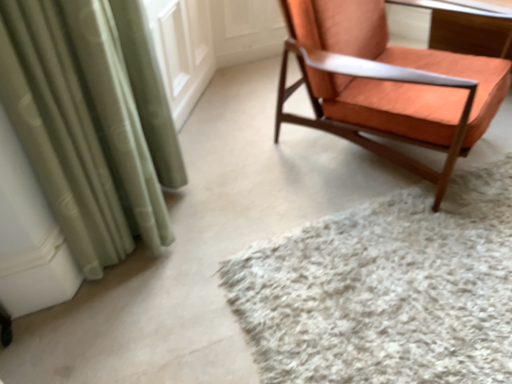
Question: Is orange fabric chair at upper right taller or shorter than wooden table at upper right?

Choices:
 (A) tall
 (B) short

Answer: (A)

Question: Looking at their shapes, would you say orange fabric chair at upper right is wider or thinner than wooden table at upper right?

Choices:
 (A) thin
 (B) wide

Answer: (B)

Question: Considering the real-world distances, which object is closest to the orange fabric chair at upper right?

Choices:
 (A) white shaggy rug at center
 (B) wooden table at upper right

Answer: (A)

Question: Which of these objects is positioned farthest from the orange fabric chair at upper right?

Choices:
 (A) wooden table at upper right
 (B) white shaggy rug at center

Answer: (A)